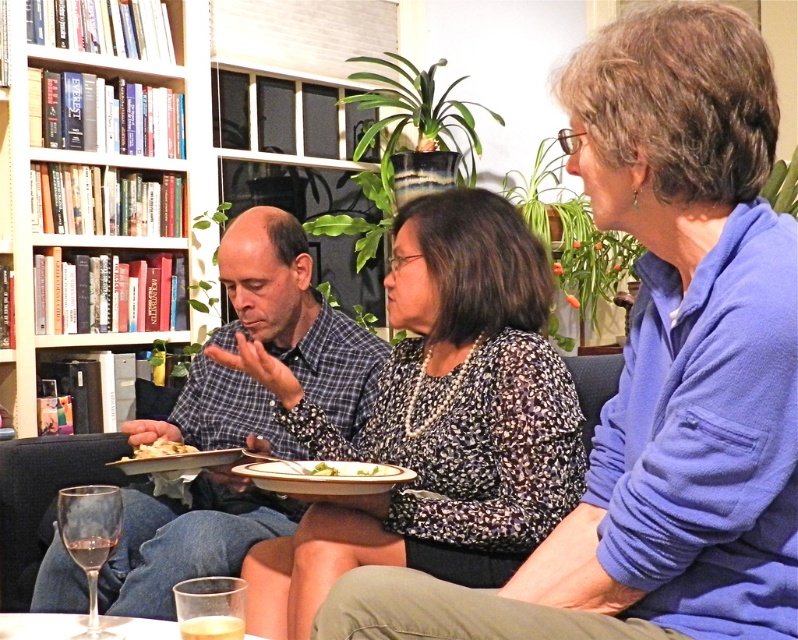
You are a chef preparing a dish and need to place both the white matte plate at center and the green leafy vegetable at center on a shelf. The shelf has a height limit of 10 cm. Can you fit both items vertically without exceeding the height limit?

The white matte plate at center is much taller than the green leafy vegetable at center. If the shelf has a height limit of 10 cm, you need to check the individual heights. However, since the exact measurements aren

You are a guest at a dinner party and see the white glossy platter at center and the green leafy vegetable at center on the table. Which item is located to the left of the other?

The white glossy platter at center is positioned on the left side of green leafy vegetable at center.